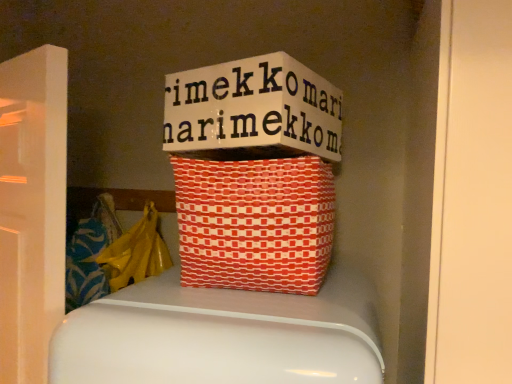
Question: Which is correct: yellow plastic bag at left is inside red woven basket at center, or outside of it?

Choices:
 (A) outside
 (B) inside

Answer: (A)

Question: From a real-world perspective, is yellow plastic bag at left above or below red woven basket at center?

Choices:
 (A) above
 (B) below

Answer: (B)

Question: From their relative heights in the image, would you say yellow plastic bag at left is taller or shorter than red woven basket at center?

Choices:
 (A) short
 (B) tall

Answer: (B)

Question: Looking at the image, does red woven basket at center seem bigger or smaller compared to yellow plastic bag at left?

Choices:
 (A) big
 (B) small

Answer: (A)

Question: From the image's perspective, is red woven basket at center located above or below yellow plastic bag at left?

Choices:
 (A) below
 (B) above

Answer: (B)

Question: Visually, is red woven basket at center positioned to the left or to the right of yellow plastic bag at left?

Choices:
 (A) right
 (B) left

Answer: (A)

Question: Is red woven basket at center situated inside yellow plastic bag at left or outside?

Choices:
 (A) outside
 (B) inside

Answer: (A)